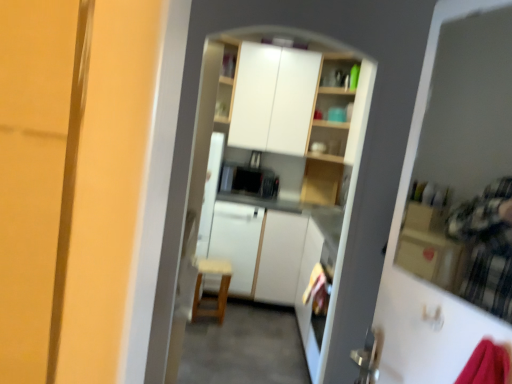
Question: Is white glossy cabinets at upper center, marked as the first cabinetry in a top-to-bottom arrangement, not inside white matte cabinet at center, which is the 1th cabinetry from bottom to top?

Choices:
 (A) no
 (B) yes

Answer: (B)

Question: Is white glossy cabinets at upper center, marked as the first cabinetry in a top-to-bottom arrangement, in contact with white matte cabinet at center, which is the 1th cabinetry from bottom to top?

Choices:
 (A) no
 (B) yes

Answer: (A)

Question: Does white glossy cabinets at upper center, marked as the first cabinetry in a top-to-bottom arrangement, have a greater width compared to white matte cabinet at center, which is the 1th cabinetry from bottom to top?

Choices:
 (A) yes
 (B) no

Answer: (B)

Question: Is white matte cabinet at center, which is the 1th cabinetry from bottom to top, inside white glossy cabinets at upper center, the second cabinetry positioned from the bottom?

Choices:
 (A) yes
 (B) no

Answer: (B)

Question: Does white glossy cabinets at upper center, marked as the first cabinetry in a top-to-bottom arrangement, appear on the right side of white matte cabinet at center, the second cabinetry viewed from the top?

Choices:
 (A) no
 (B) yes

Answer: (B)

Question: Considering their positions, is white glossy cabinets at upper center, marked as the first cabinetry in a top-to-bottom arrangement, located in front of or behind transparent plastic screen door at upper right?

Choices:
 (A) front
 (B) behind

Answer: (B)

Question: From a real-world perspective, is white glossy cabinets at upper center, marked as the first cabinetry in a top-to-bottom arrangement, positioned above or below transparent plastic screen door at upper right?

Choices:
 (A) above
 (B) below

Answer: (A)

Question: Is white glossy cabinets at upper center, marked as the first cabinetry in a top-to-bottom arrangement, taller or shorter than transparent plastic screen door at upper right?

Choices:
 (A) short
 (B) tall

Answer: (B)

Question: Would you say white glossy cabinets at upper center, the second cabinetry positioned from the bottom, is to the left or to the right of transparent plastic screen door at upper right in the picture?

Choices:
 (A) left
 (B) right

Answer: (A)

Question: In the image, is white matte cabinet at center, the second cabinetry viewed from the top, on the left side or the right side of transparent plastic screen door at upper right?

Choices:
 (A) right
 (B) left

Answer: (B)

Question: Is point (260, 279) positioned closer to the camera than point (409, 137)?

Choices:
 (A) farther
 (B) closer

Answer: (A)

Question: From the image's perspective, is white matte cabinet at center, the second cabinetry viewed from the top, positioned above or below transparent plastic screen door at upper right?

Choices:
 (A) below
 (B) above

Answer: (A)

Question: Is white matte cabinet at center, the second cabinetry viewed from the top, spatially inside transparent plastic screen door at upper right, or outside of it?

Choices:
 (A) inside
 (B) outside

Answer: (B)

Question: Based on their positions, is white glossy cabinets at upper center, marked as the first cabinetry in a top-to-bottom arrangement, located to the left or right of wooden chair at center?

Choices:
 (A) left
 (B) right

Answer: (B)

Question: Choose the correct answer: Is white glossy cabinets at upper center, marked as the first cabinetry in a top-to-bottom arrangement, inside wooden chair at center or outside it?

Choices:
 (A) inside
 (B) outside

Answer: (B)